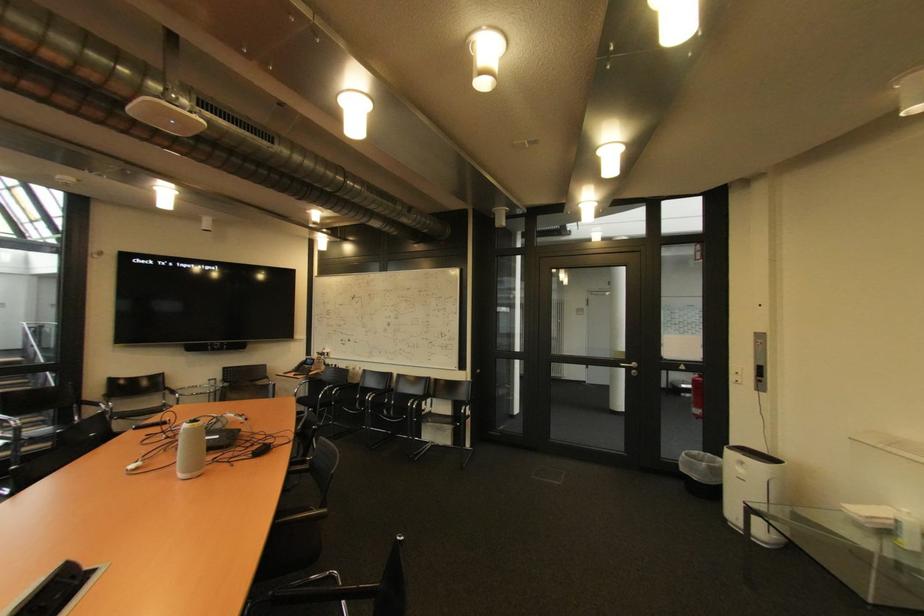
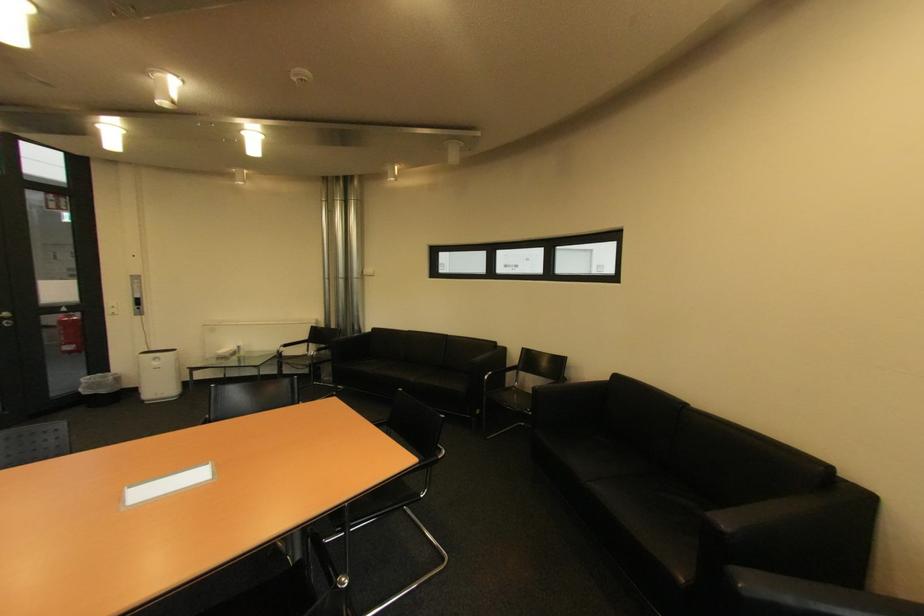
The point at (642,365) is marked in the first image. Where is the corresponding point in the second image?

(14, 315)